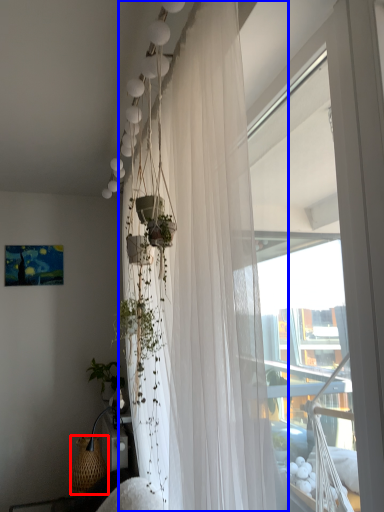
Question: Which of the following is the farthest to the observer, basket (highlighted by a red box) or curtain (highlighted by a blue box)?

Choices:
 (A) basket
 (B) curtain

Answer: (A)